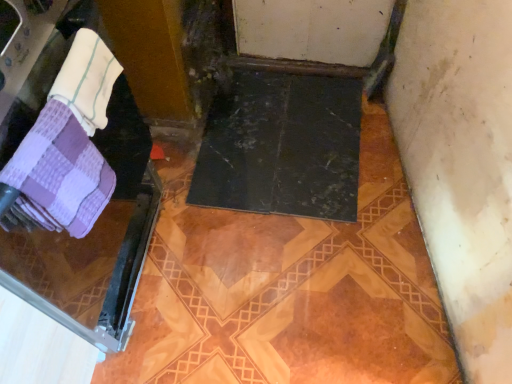
Question: Is white terry cloth towel at upper left, the 2th towel in the bottom-to-top sequence, shorter than purple checkered towel at left, placed as the 2th towel when sorted from top to bottom?

Choices:
 (A) no
 (B) yes

Answer: (B)

Question: From the image's perspective, is white terry cloth towel at upper left, the 2th towel in the bottom-to-top sequence, below purple checkered towel at left, the first towel in the bottom-to-top sequence?

Choices:
 (A) yes
 (B) no

Answer: (B)

Question: Is white terry cloth towel at upper left, the 2th towel in the bottom-to-top sequence, far away from purple checkered towel at left, the first towel in the bottom-to-top sequence?

Choices:
 (A) yes
 (B) no

Answer: (B)

Question: Considering the relative sizes of white terry cloth towel at upper left, which is the first towel in top-to-bottom order, and purple checkered towel at left, the first towel in the bottom-to-top sequence, in the image provided, is white terry cloth towel at upper left, which is the first towel in top-to-bottom order, wider than purple checkered towel at left, the first towel in the bottom-to-top sequence,?

Choices:
 (A) no
 (B) yes

Answer: (A)

Question: Is white terry cloth towel at upper left, which is the first towel in top-to-bottom order, in contact with purple checkered towel at left, placed as the 2th towel when sorted from top to bottom?

Choices:
 (A) no
 (B) yes

Answer: (B)

Question: Looking at their shapes, would you say white terry cloth towel at upper left, which is the first towel in top-to-bottom order, is wider or thinner than purple checkered towel at left?

Choices:
 (A) wide
 (B) thin

Answer: (B)

Question: From the image's perspective, is white terry cloth towel at upper left, the 2th towel in the bottom-to-top sequence, above or below purple checkered towel at left?

Choices:
 (A) below
 (B) above

Answer: (B)

Question: Is white terry cloth towel at upper left, which is the first towel in top-to-bottom order, taller or shorter than purple checkered towel at left?

Choices:
 (A) short
 (B) tall

Answer: (A)

Question: In the image, is white terry cloth towel at upper left, the 2th towel in the bottom-to-top sequence, on the left side or the right side of purple checkered towel at left?

Choices:
 (A) right
 (B) left

Answer: (A)

Question: From their relative heights in the image, would you say purple checkered towel at left, the first towel in the bottom-to-top sequence, is taller or shorter than white terry cloth towel at upper left, which is the first towel in top-to-bottom order?

Choices:
 (A) short
 (B) tall

Answer: (B)

Question: Is purple checkered towel at left, placed as the 2th towel when sorted from top to bottom, bigger or smaller than white terry cloth towel at upper left, which is the first towel in top-to-bottom order?

Choices:
 (A) small
 (B) big

Answer: (B)

Question: Is purple checkered towel at left, placed as the 2th towel when sorted from top to bottom, to the left or to the right of white terry cloth towel at upper left, which is the first towel in top-to-bottom order, in the image?

Choices:
 (A) left
 (B) right

Answer: (A)

Question: Relative to white terry cloth towel at upper left, the 2th towel in the bottom-to-top sequence, is purple checkered towel at left, placed as the 2th towel when sorted from top to bottom, in front or behind?

Choices:
 (A) behind
 (B) front

Answer: (B)

Question: Considering the positions of purple checkered towel at left and white terry cloth towel at upper left, the 2th towel in the bottom-to-top sequence, in the image, is purple checkered towel at left wider or thinner than white terry cloth towel at upper left, the 2th towel in the bottom-to-top sequence,?

Choices:
 (A) thin
 (B) wide

Answer: (B)

Question: Considering their positions, is purple checkered towel at left located in front of or behind white terry cloth towel at upper left, which is the first towel in top-to-bottom order?

Choices:
 (A) front
 (B) behind

Answer: (A)